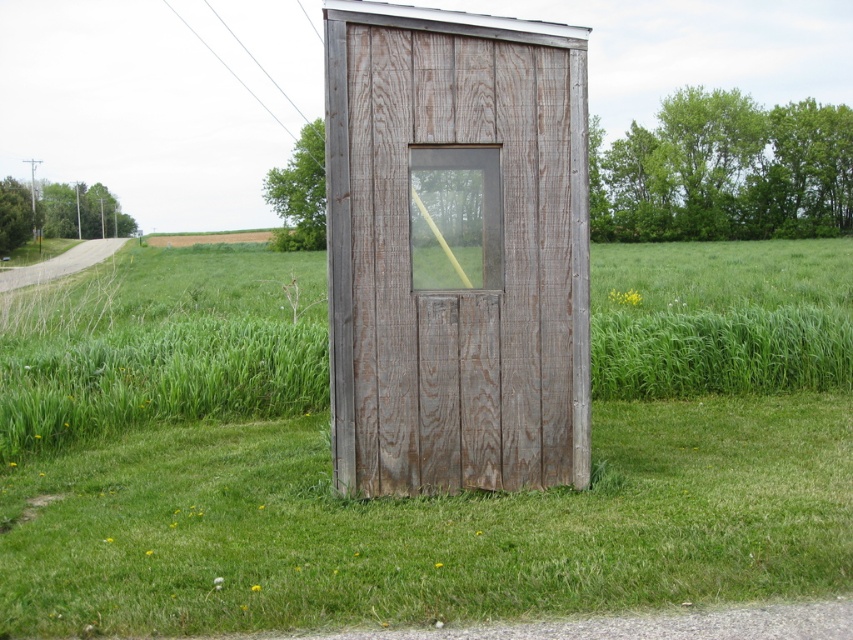
Which of these two, weathered wood hut at center or weathered wood door at center, stands taller?

Standing taller between the two is weathered wood hut at center.

Looking at this image, between weathered wood hut at center and weathered wood door at center, which one appears on the right side from the viewer's perspective?

From the viewer's perspective, weathered wood door at center appears more on the right side.

What do you see at coordinates (456, 250) in the screenshot? The height and width of the screenshot is (640, 853). I see `weathered wood hut at center` at bounding box center [456, 250].

Find the location of a particular element. The image size is (853, 640). weathered wood hut at center is located at coordinates (456, 250).

Is wooden shed at center to the left of weathered wood hut at center from the viewer's perspective?

Indeed, wooden shed at center is positioned on the left side of weathered wood hut at center.

Can you confirm if wooden shed at center is positioned below weathered wood hut at center?

Yes, wooden shed at center is below weathered wood hut at center.

Is point (251, 602) positioned in front of point (477, 141)?

Yes, point (251, 602) is closer to viewer.

The image size is (853, 640). I want to click on wooden shed at center, so click(421, 497).

This screenshot has width=853, height=640. What do you see at coordinates (421, 497) in the screenshot?
I see `wooden shed at center` at bounding box center [421, 497].

Between wooden shed at center and weathered wood door at center, which one has more height?

Standing taller between the two is wooden shed at center.

Is point (747, 314) positioned behind point (409, 212)?

Yes.

You are a GUI agent. You are given a task and a screenshot of the screen. Output one action in this format:
    pyautogui.click(x=<x>, y=<y>)
    Task: Click on the wooden shed at center
    The height and width of the screenshot is (640, 853).
    Given the screenshot: What is the action you would take?
    pyautogui.click(x=421, y=497)